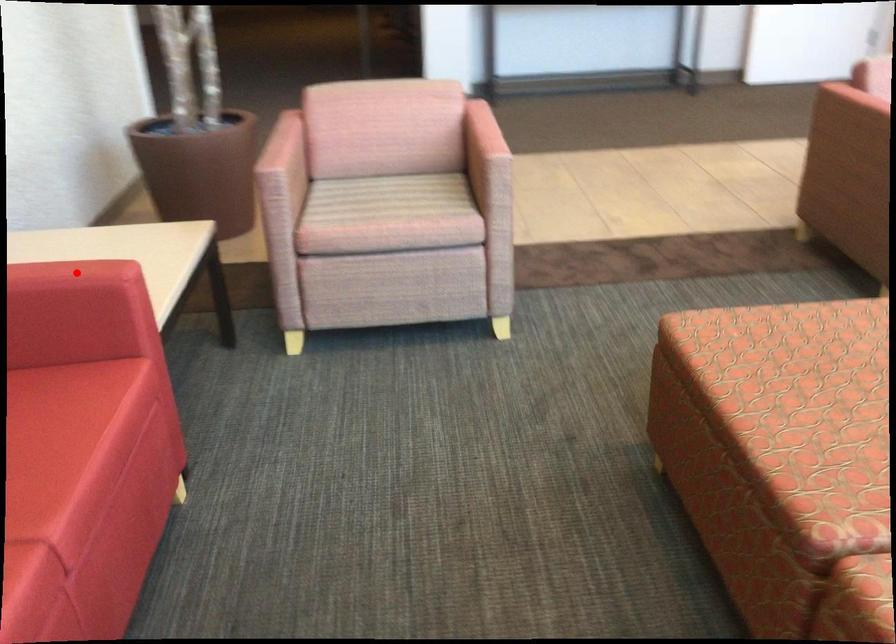
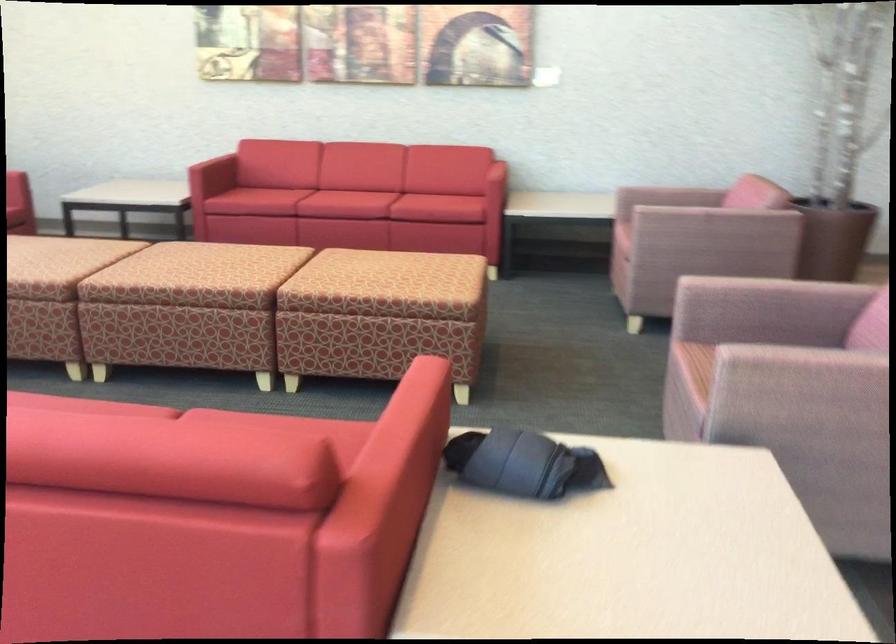
Question: I am providing you with two images of the same scene from different viewpoints. A red point is marked on the first image. At the location where the point appears in image 1, is it still visible in image 2?

Choices:
 (A) Yes
 (B) No

Answer: (B)